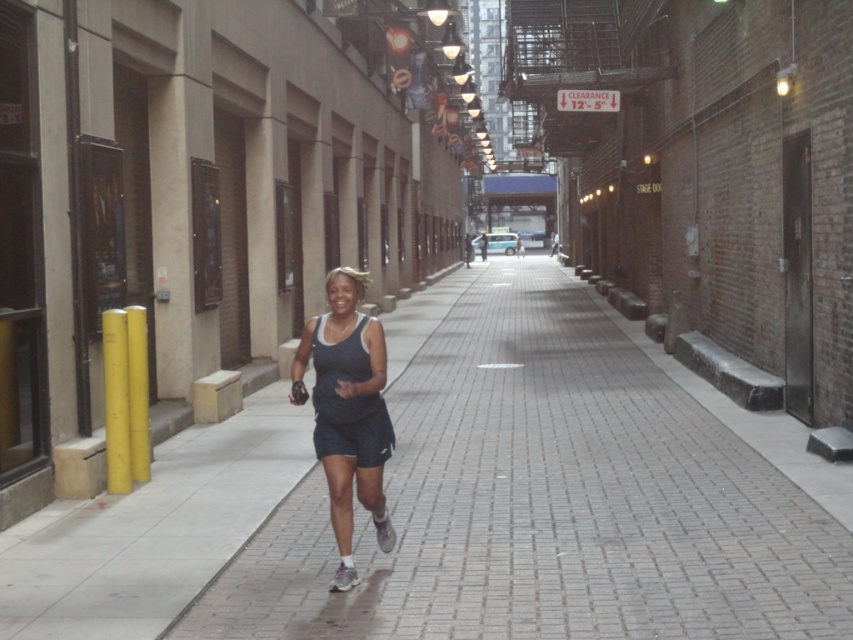
You are standing in the alley and notice a point marked at coordinates (548,500). According to the scene description, where exactly is this point located?

The point is located on the brick pavement at the center of the alley.

In the scene shown: You are a delivery drone flying above the alleyway. You need to deliver a package to the brick pavement at center without hitting the dark blue fabric tank top at center. Can you safely land the package there?

The brick pavement at center is shorter than the dark blue fabric tank top at center, so the drone cannot safely land there as the tank top is taller and may obstruct the landing area.